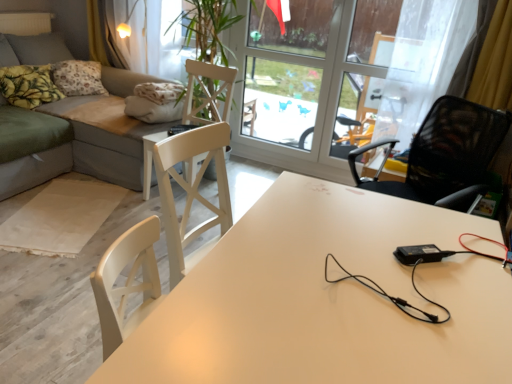
Question: From the image's perspective, relative to yellow printed fabric pillow at upper left, the first pillow viewed from the back, is gray fabric couch at left above or below?

Choices:
 (A) above
 (B) below

Answer: (B)

Question: Considering the positions of gray fabric couch at left and yellow printed fabric pillow at upper left, the first pillow viewed from the back, in the image, is gray fabric couch at left bigger or smaller than yellow printed fabric pillow at upper left, the first pillow viewed from the back,?

Choices:
 (A) small
 (B) big

Answer: (B)

Question: Which object is the farthest from the white glossy table at center?

Choices:
 (A) transparent glass screen door at upper center
 (B) gray fabric couch at left
 (C) yellow printed fabric pillow at upper left, the first pillow viewed from the back
 (D) transparent glass window at upper center
 (E) white wood chair at center, the 1th chair viewed from the back

Answer: (C)

Question: Which object is the closest to the yellow printed fabric pillow at upper left, the second pillow when ordered from back to front?

Choices:
 (A) gray fabric couch at left
 (B) white glossy table at center
 (C) white wood chair at center, which appears as the 2th chair when viewed from the right
 (D) transparent glass window at upper center
 (E) yellow printed fabric pillow at upper left, which appears as the second pillow when viewed from the front

Answer: (E)